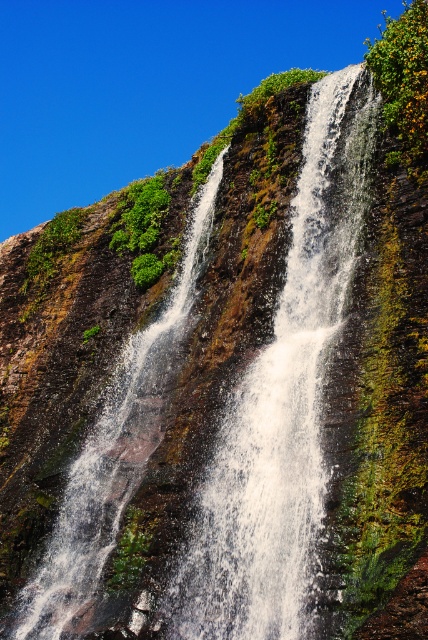
You are standing at the base of the waterfall and notice two points marked on the cliff face. The first point is at coordinates point (x=276, y=504) and the second is at point (x=95, y=484). Which point is closer to your current position?

Point (x=276, y=504) is closer to the viewer than point (x=95, y=484), so the first point is closer to your current position.